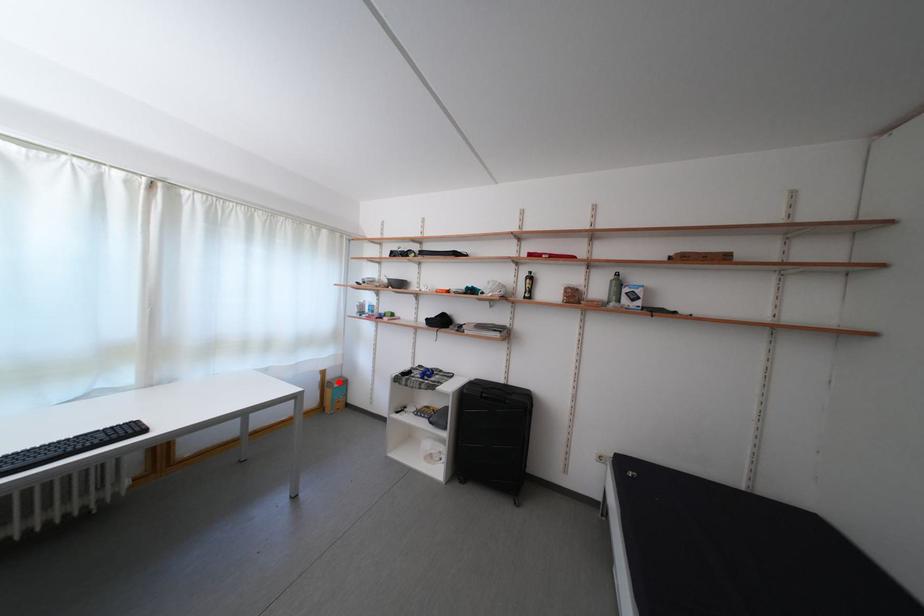
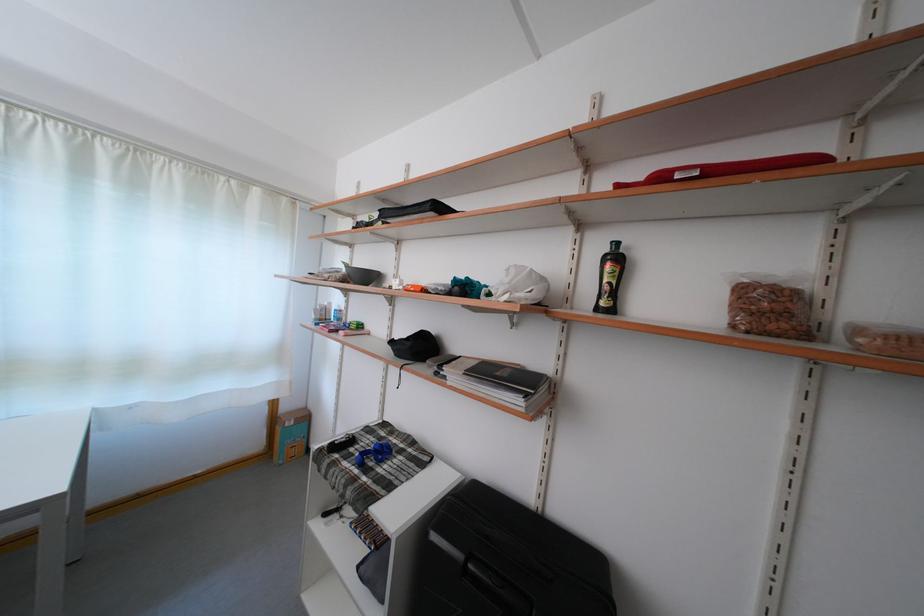
Locate, in the second image, the point that corresponds to the highlighted location in the first image.

(293, 415)